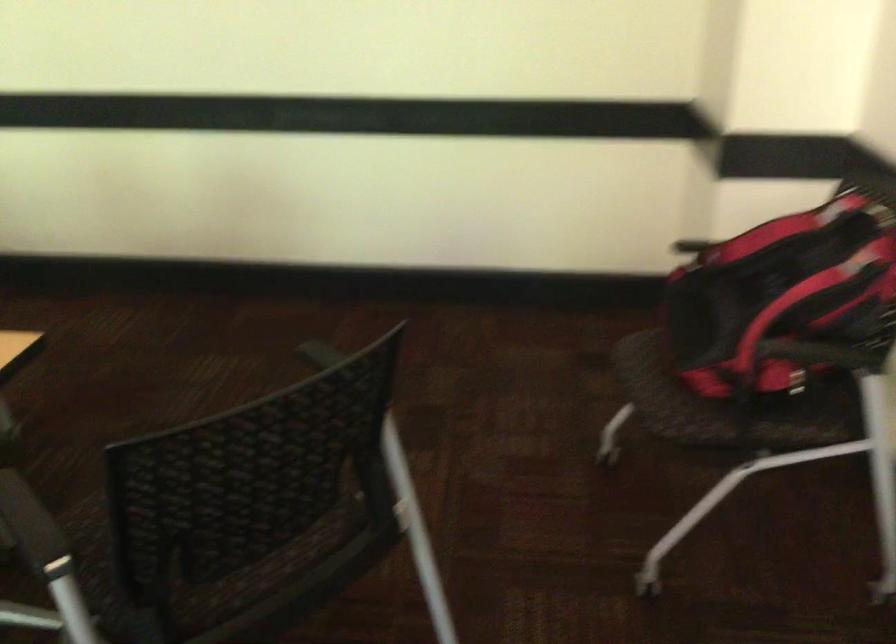
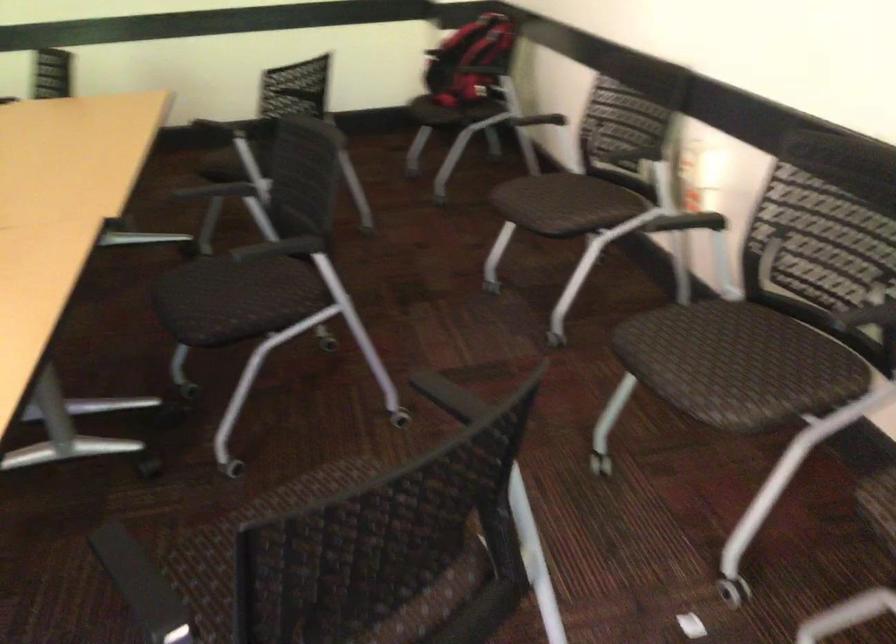
Locate, in the second image, the point that corresponds to point (799, 336) in the first image.

(471, 61)